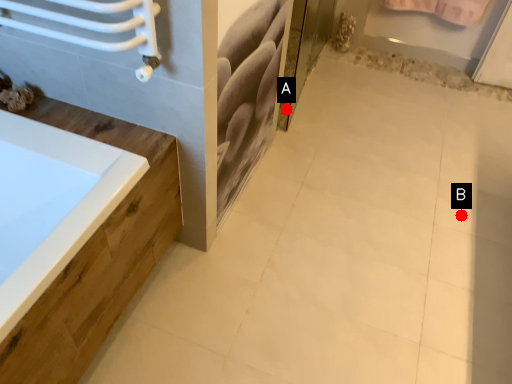
Question: Two points are circled on the image, labeled by A and B beside each circle. Which point is farther to the camera?

Choices:
 (A) A is further
 (B) B is further

Answer: (A)